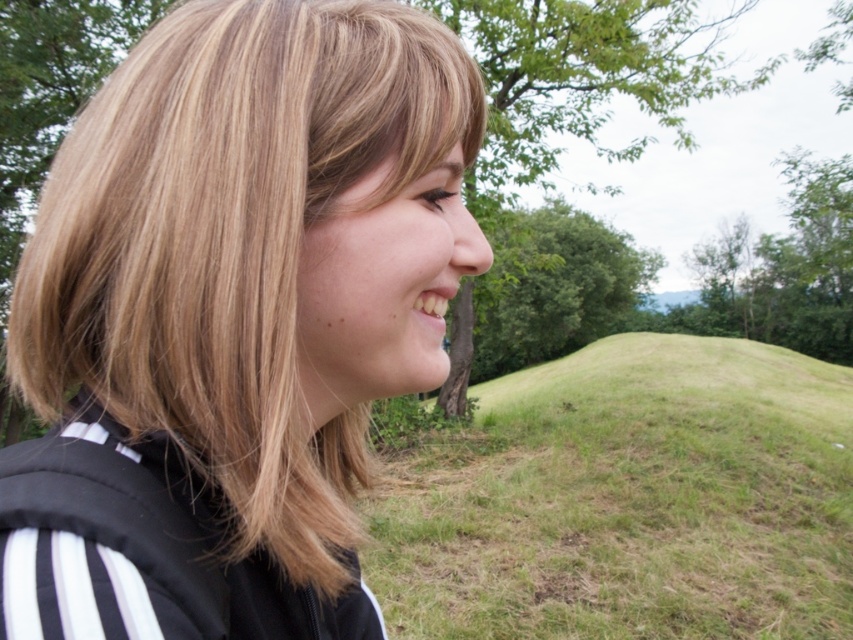
You are standing in the park scene shown. There are two points marked in the image, point (231, 564) and point (843, 636). Which point is nearer to you?

Point (231, 564) is closer to the viewer than point (843, 636).

You are a photographer trying to capture the person in the image. Since the person has blonde hair at center and green grassy hill at center, which one is closer to the camera?

The blonde hair at center is closer to the camera because it is in front of the green grassy hill at center.